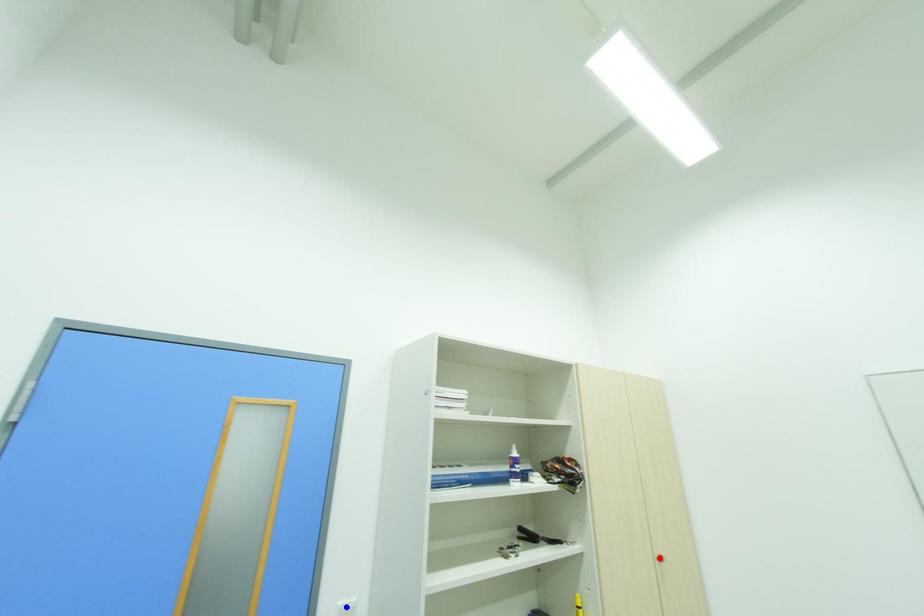
Question: In the image, two points are highlighted. Which point is nearer to the camera? Reply with the corresponding letter.

Choices:
 (A) blue point
 (B) red point

Answer: (A)